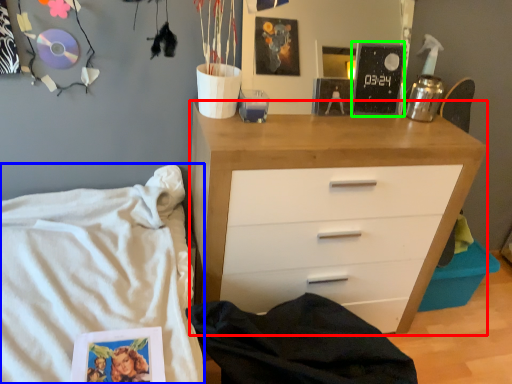
Question: Based on their relative distances, which object is nearer to chest of drawers (highlighted by a red box)? Choose from bed (highlighted by a blue box) and magazine (highlighted by a green box).

Choices:
 (A) bed
 (B) magazine

Answer: (B)